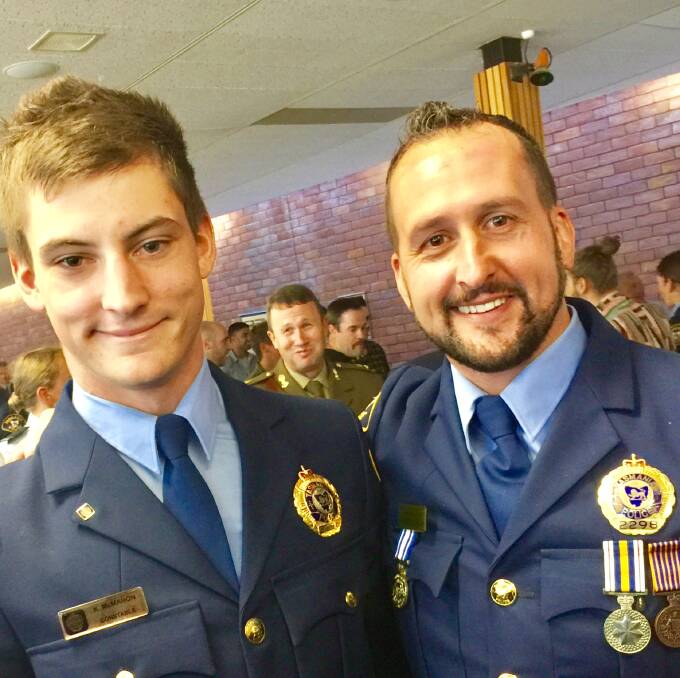
Find the location of a particular element. ceiling is located at coordinates (279, 85).